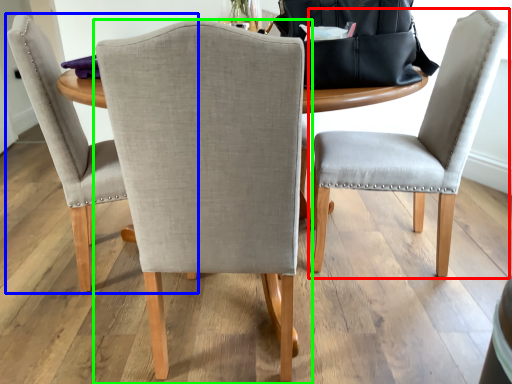
Question: Based on their relative distances, which object is nearer to chair (highlighted by a red box)? Choose from chair (highlighted by a blue box) and chair (highlighted by a green box).

Choices:
 (A) chair
 (B) chair

Answer: (B)